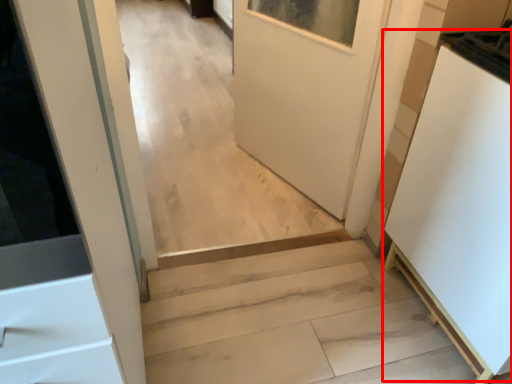
Question: Considering the relative positions of appliance (annotated by the red box) and stairs in the image provided, where is appliance (annotated by the red box) located with respect to the staircase?

Choices:
 (A) left
 (B) right

Answer: (B)